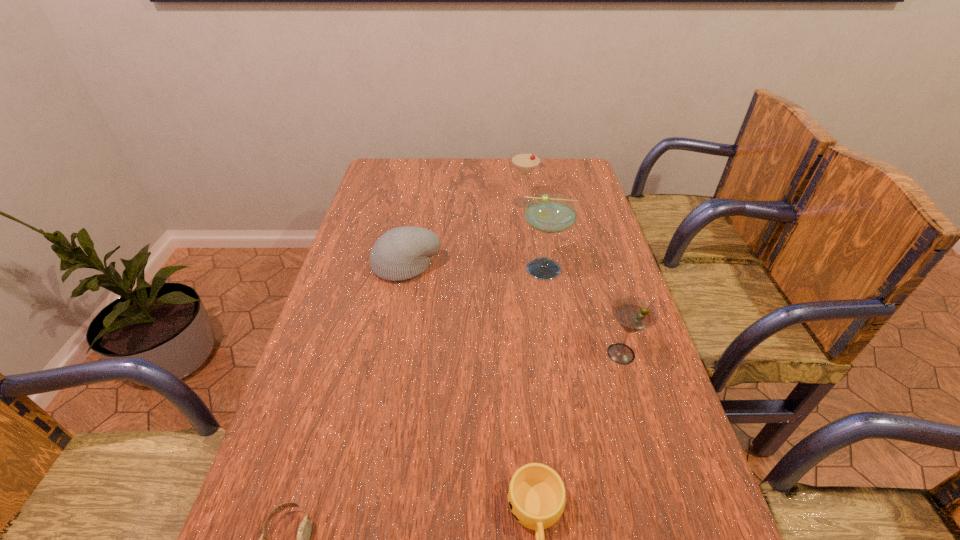
Where is `the closest martini to the cup`? The width and height of the screenshot is (960, 540). the closest martini to the cup is located at coordinates (634, 314).

Identify the location of martini that can be found as the closest to the rightmost object. The height and width of the screenshot is (540, 960). (547, 213).

Locate an element on the screen. The width and height of the screenshot is (960, 540). free location that satisfies the following two spatial constraints: 1. on the back side of the beanie; 2. on the left side of the farthest object is located at coordinates (419, 202).

Find the location of a particular element. The image size is (960, 540). vacant space that satisfies the following two spatial constraints: 1. on the front side of the farthest martini; 2. on the right side of the rightmost object is located at coordinates (542, 354).

Identify the location of free location that satisfies the following two spatial constraints: 1. on the front side of the nearest martini; 2. on the left side of the beanie. (390, 354).